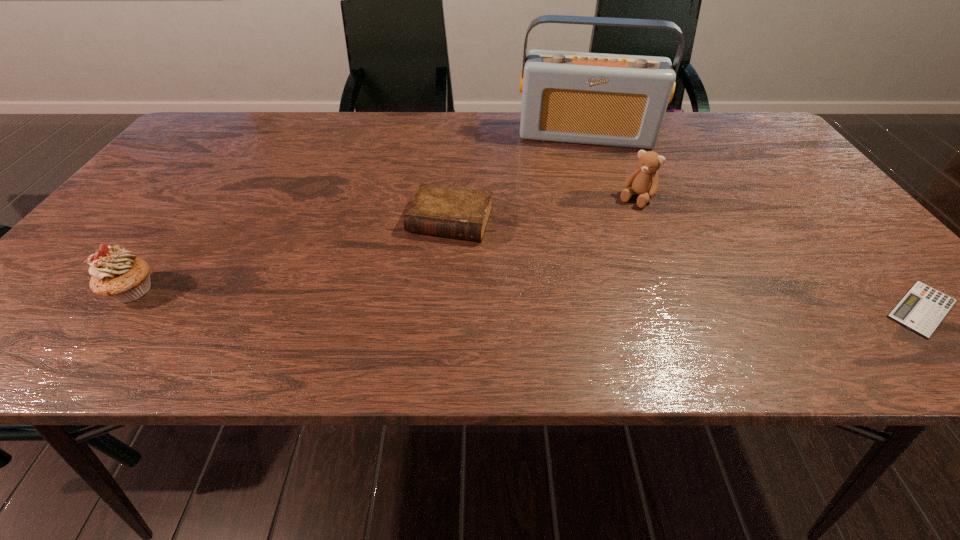
You are a GUI agent. You are given a task and a screenshot of the screen. Output one action in this format:
    pyautogui.click(x=<x>, y=<y>)
    Task: Click on the vacant space located on the front-facing side of the teddy bear
    The height and width of the screenshot is (540, 960).
    Given the screenshot: What is the action you would take?
    pyautogui.click(x=607, y=238)

The width and height of the screenshot is (960, 540). Identify the location of vacant region located 0.110m on the front-facing side of the teddy bear. (611, 233).

At what (x,y) coordinates should I click in order to perform the action: click on vacant position located 0.300m on the front-facing side of the teddy bear. Please return your answer as a coordinate pair (x, y). Looking at the image, I should click on (570, 285).

At what (x,y) coordinates should I click in order to perform the action: click on vacant space located on the spine side of the fourth object from right to left. Please return your answer as a coordinate pair (x, y). This screenshot has width=960, height=540. Looking at the image, I should click on (429, 271).

Locate an element on the screen. The width and height of the screenshot is (960, 540). vacant area situated 0.060m on the spine side of the fourth object from right to left is located at coordinates (432, 264).

Identify the location of blank area located on the spine side of the fourth object from right to left. Image resolution: width=960 pixels, height=540 pixels. (430, 267).

The image size is (960, 540). I want to click on object located at the far edge, so click(x=617, y=100).

At what (x,y) coordinates should I click in order to perform the action: click on object that is at the near edge. Please return your answer as a coordinate pair (x, y). The image size is (960, 540). Looking at the image, I should click on (117, 273).

Where is `object that is positioned at the left edge`? The image size is (960, 540). object that is positioned at the left edge is located at coordinates (117, 273).

Identify the location of object at the near left corner. This screenshot has width=960, height=540. (117, 273).